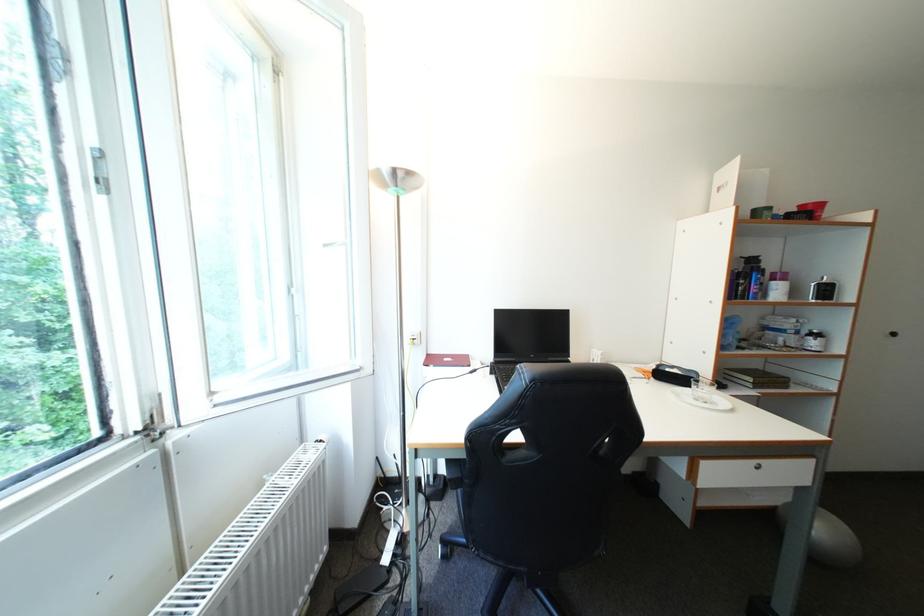
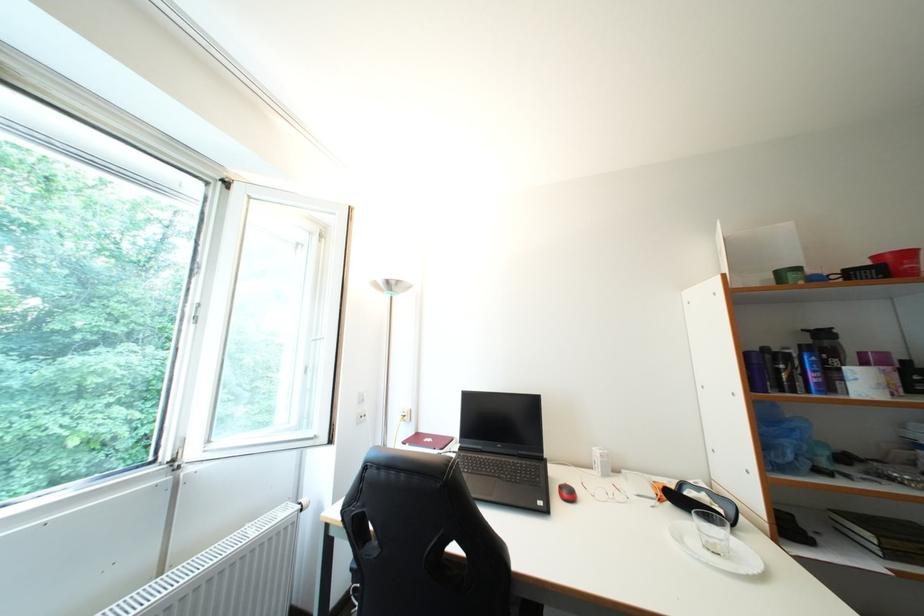
Based on the continuous images, in which direction is the camera rotating?

The camera rotated toward left-up.